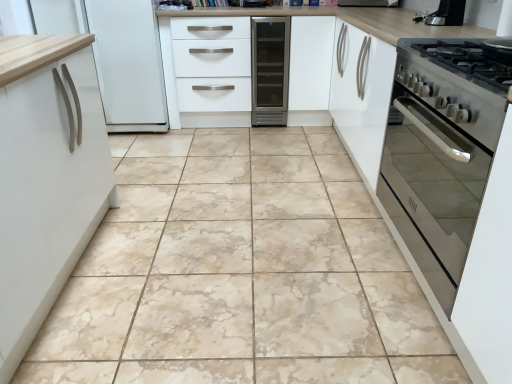
Question: Is satin black coffee machine at upper right behind satin silver wine cooler at center?

Choices:
 (A) no
 (B) yes

Answer: (A)

Question: Is satin black coffee machine at upper right at the right side of satin silver wine cooler at center?

Choices:
 (A) yes
 (B) no

Answer: (A)

Question: Is satin black coffee machine at upper right bigger than satin silver wine cooler at center?

Choices:
 (A) yes
 (B) no

Answer: (B)

Question: Is satin black coffee machine at upper right outside satin silver wine cooler at center?

Choices:
 (A) yes
 (B) no

Answer: (A)

Question: Can you confirm if satin black coffee machine at upper right is shorter than satin silver wine cooler at center?

Choices:
 (A) yes
 (B) no

Answer: (A)

Question: Can you confirm if satin black coffee machine at upper right is positioned to the left of satin silver wine cooler at center?

Choices:
 (A) yes
 (B) no

Answer: (B)

Question: Does white matte drawer at center have a larger size compared to stainless steel oven at right?

Choices:
 (A) yes
 (B) no

Answer: (A)

Question: Does white matte drawer at center come in front of stainless steel oven at right?

Choices:
 (A) no
 (B) yes

Answer: (A)

Question: Is white matte drawer at center far away from stainless steel oven at right?

Choices:
 (A) no
 (B) yes

Answer: (B)

Question: From a real-world perspective, is white matte drawer at center positioned over stainless steel oven at right based on gravity?

Choices:
 (A) yes
 (B) no

Answer: (A)

Question: Is white matte drawer at center placed right next to stainless steel oven at right?

Choices:
 (A) no
 (B) yes

Answer: (A)

Question: Is white matte drawer at center positioned behind stainless steel oven at right?

Choices:
 (A) no
 (B) yes

Answer: (B)

Question: Would you say stainless steel oven at right is outside satin black coffee machine at upper right?

Choices:
 (A) no
 (B) yes

Answer: (B)